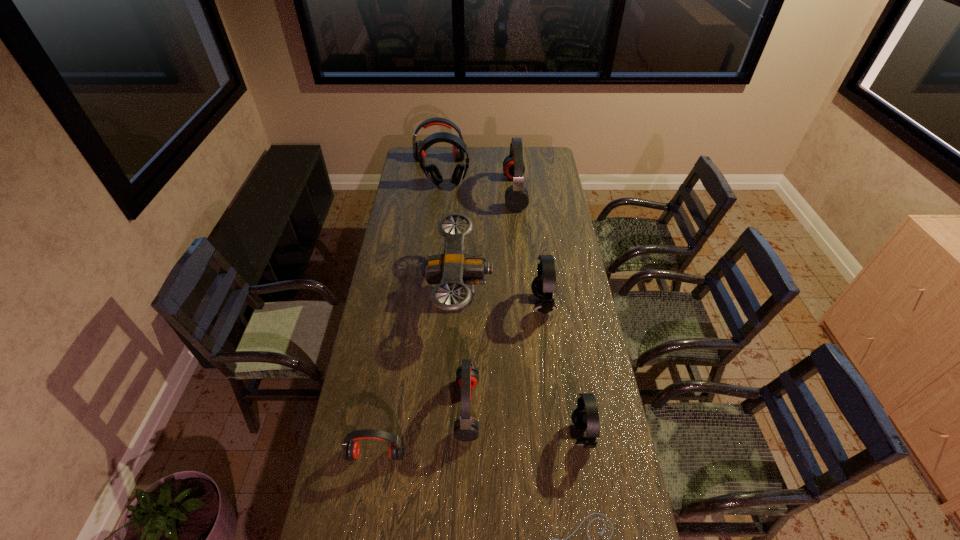
Where is `free space at the far edge of the desktop`? Image resolution: width=960 pixels, height=540 pixels. free space at the far edge of the desktop is located at coordinates (480, 147).

The height and width of the screenshot is (540, 960). Find the location of `vacant space at the left edge`. vacant space at the left edge is located at coordinates (342, 452).

The width and height of the screenshot is (960, 540). In the image, there is a desktop. Find the location of `free region at the right edge`. free region at the right edge is located at coordinates (575, 282).

You are a GUI agent. You are given a task and a screenshot of the screen. Output one action in this format:
    pyautogui.click(x=<x>, y=<y>)
    Task: Click on the unoccupied area between the nearest black earphone and the third red earphone from left to right
    The width and height of the screenshot is (960, 540).
    Given the screenshot: What is the action you would take?
    pyautogui.click(x=524, y=421)

Identify the location of free point between the second nearest black earphone and the second farthest red earphone. (528, 248).

You are a GUI agent. You are given a task and a screenshot of the screen. Output one action in this format:
    pyautogui.click(x=<x>, y=<y>)
    Task: Click on the free space between the second shortest object and the second red earphone from right to left
    Image resolution: width=960 pixels, height=540 pixels.
    Given the screenshot: What is the action you would take?
    pyautogui.click(x=421, y=431)

This screenshot has height=540, width=960. I want to click on free space that is in between the farthest black earphone and the biggest red earphone, so click(x=480, y=188).

Find the location of a particular element. Image resolution: width=960 pixels, height=540 pixels. vacant region between the biggest black earphone and the biggest red earphone is located at coordinates click(480, 188).

The width and height of the screenshot is (960, 540). In order to click on object that is the eighth closest to the yellow drone in this screenshot , I will do `click(457, 154)`.

Locate which object ranks sixth in proximity to the nearest black earphone. Please provide its 2D coordinates. Your answer should be formatted as a tuple, i.e. [(x, y)], where the tuple contains the x and y coordinates of a point satisfying the conditions above.

[(516, 196)]